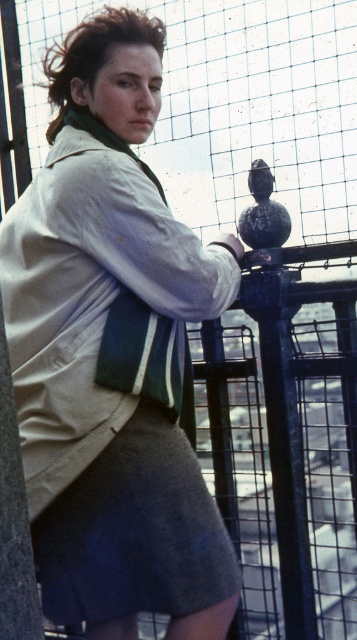
You are a fashion stylist observing a person wearing a beige cotton jacket at upper left and a gray cotton skirt at lower center. Which clothing item is positioned more to the left side of the person?

The beige cotton jacket at upper left is positioned more to the left side of the person than the gray cotton skirt at lower center.

You are a fashion designer observing a model wearing the beige cotton jacket at upper left and gray cotton skirt at lower center. Can you determine if there is enough space between the two items to comfortably add a belt?

The beige cotton jacket at upper left and gray cotton skirt at lower center are 15.51 inches apart. Since 15.51 inches is more than enough space to add a belt comfortably, the answer is yes.

You are a photographer trying to capture a portrait of the person in the scene. You notice two points marked in the image. The first point is at coordinate point [49,376] and the second is at point [52,573]. Which point should you focus on to ensure the subject is in sharp focus?

You should focus on point [49,376] because it is closer to the camera than point [52,573], ensuring the subject is in sharp focus.